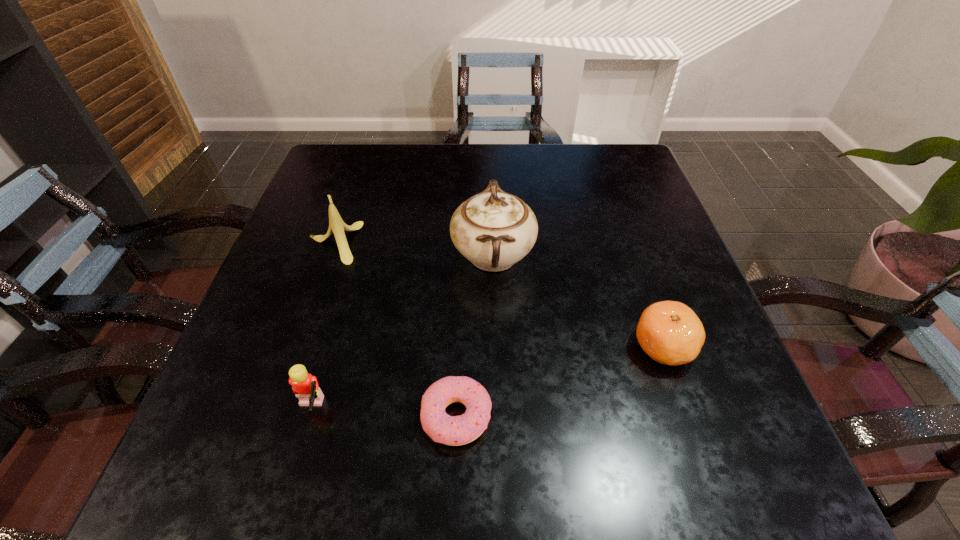
Locate an element on the screen. Image resolution: width=960 pixels, height=540 pixels. free space between the chinaware and the third nearest object is located at coordinates (578, 301).

Where is `vacant point located between the doughnut and the chinaware`? vacant point located between the doughnut and the chinaware is located at coordinates (475, 336).

Select which object appears as the second closest to the third nearest object. Please provide its 2D coordinates. Your answer should be formatted as a tuple, i.e. [(x, y)], where the tuple contains the x and y coordinates of a point satisfying the conditions above.

[(450, 430)]

Select which object is the closest to the banana. Please provide its 2D coordinates. Your answer should be formatted as a tuple, i.e. [(x, y)], where the tuple contains the x and y coordinates of a point satisfying the conditions above.

[(493, 229)]

Identify the location of free location that satisfies the following two spatial constraints: 1. on the front side of the tallest object; 2. in front of the Lego with the accessory visible. (497, 410).

Locate an element on the screen. vacant space that satisfies the following two spatial constraints: 1. on the front side of the banana; 2. on the right side of the rightmost object is located at coordinates (297, 347).